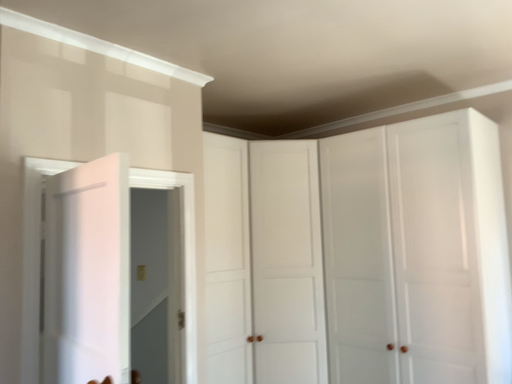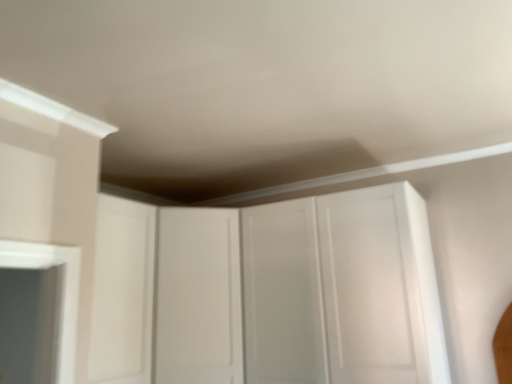
Question: Which way did the camera rotate in the video?

Choices:
 (A) rotated upward
 (B) rotated downward

Answer: (A)